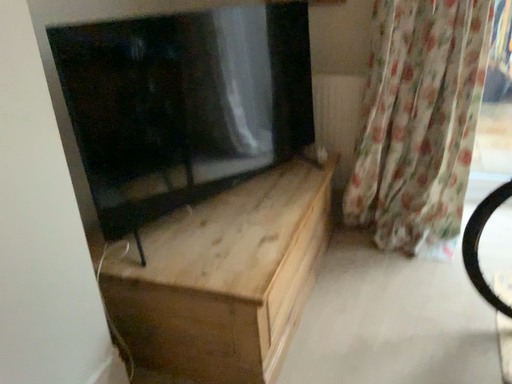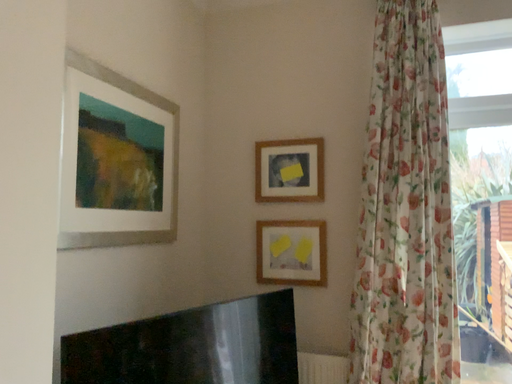
Question: How did the camera likely rotate when shooting the video?

Choices:
 (A) rotated upward
 (B) rotated downward

Answer: (A)